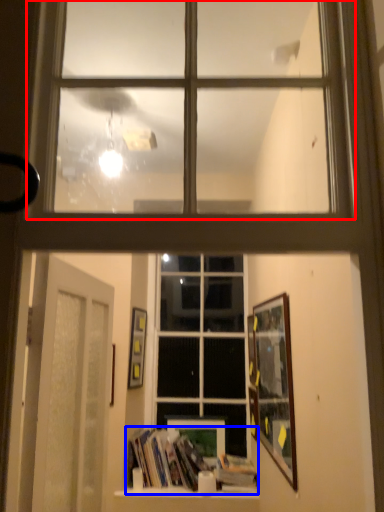
Question: Which object is further to the camera taking this photo, window (highlighted by a red box) or book (highlighted by a blue box)?

Choices:
 (A) window
 (B) book

Answer: (B)